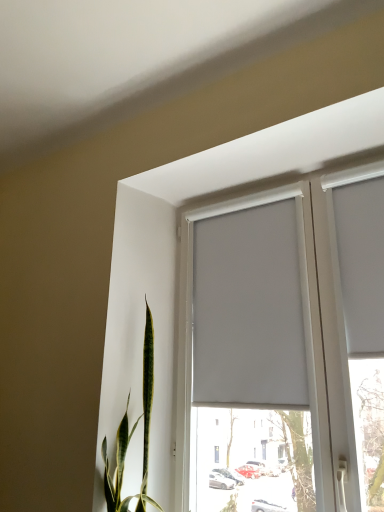
Question: Is white matte curtain at upper center, the 2th curtain from the right, thinner than white matte window at center?

Choices:
 (A) no
 (B) yes

Answer: (B)

Question: From the image's perspective, is white matte curtain at upper center, the 2th curtain from the right, above white matte window at center?

Choices:
 (A) yes
 (B) no

Answer: (A)

Question: Can you confirm if white matte curtain at upper center, the 2th curtain from the right, is wider than white matte window at center?

Choices:
 (A) yes
 (B) no

Answer: (B)

Question: Does white matte curtain at upper center, the first curtain positioned from the left, have a smaller size compared to white matte window at center?

Choices:
 (A) yes
 (B) no

Answer: (A)

Question: From a real-world perspective, is white matte curtain at upper center, the 2th curtain from the right, physically below white matte window at center?

Choices:
 (A) yes
 (B) no

Answer: (B)

Question: From a real-world perspective, is white matte curtain at upper center, the first curtain positioned from the left, on white matte window at center?

Choices:
 (A) no
 (B) yes

Answer: (B)

Question: Can you confirm if white matte curtain at upper right, which is counted as the second curtain, starting from the left, is smaller than white matte curtain at upper center, the 2th curtain from the right?

Choices:
 (A) yes
 (B) no

Answer: (A)

Question: Can you confirm if white matte curtain at upper right, which is counted as the second curtain, starting from the left, is taller than white matte curtain at upper center, the 2th curtain from the right?

Choices:
 (A) no
 (B) yes

Answer: (A)

Question: From the image's perspective, would you say white matte curtain at upper right, which is counted as the second curtain, starting from the left, is shown under white matte curtain at upper center, the 2th curtain from the right?

Choices:
 (A) yes
 (B) no

Answer: (B)

Question: Is white matte curtain at upper right, the 1th curtain when ordered from right to left, at the right side of white matte curtain at upper center, the 2th curtain from the right?

Choices:
 (A) no
 (B) yes

Answer: (B)

Question: Considering the relative positions of white matte curtain at upper right, which is counted as the second curtain, starting from the left, and white matte curtain at upper center, the 2th curtain from the right, in the image provided, is white matte curtain at upper right, which is counted as the second curtain, starting from the left, to the left of white matte curtain at upper center, the 2th curtain from the right, from the viewer's perspective?

Choices:
 (A) yes
 (B) no

Answer: (B)

Question: Are white matte curtain at upper right, which is counted as the second curtain, starting from the left, and white matte curtain at upper center, the first curtain positioned from the left, located far from each other?

Choices:
 (A) yes
 (B) no

Answer: (B)

Question: Does white matte curtain at upper center, the 2th curtain from the right, have a larger size compared to white matte curtain at upper right, the 1th curtain when ordered from right to left?

Choices:
 (A) no
 (B) yes

Answer: (B)